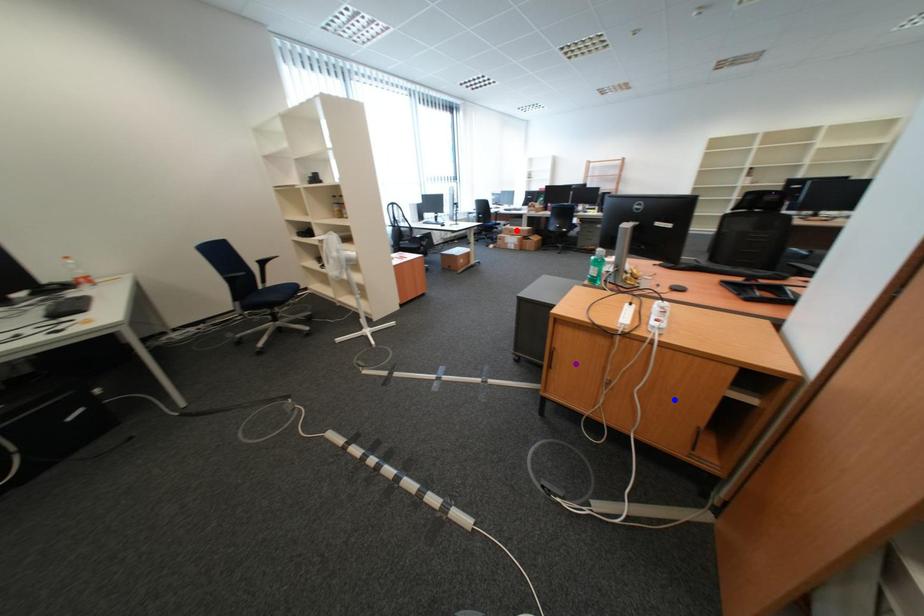
Order these from farthest to nearest:
A) blue point
B) red point
C) purple point

1. red point
2. purple point
3. blue point